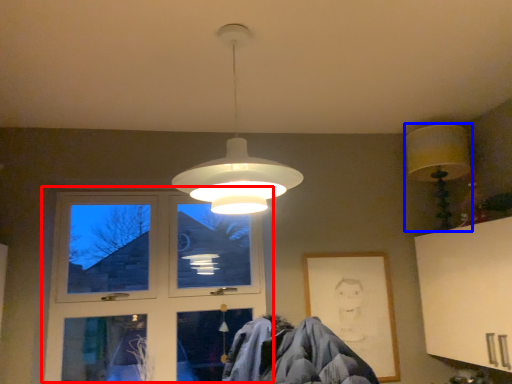
Question: Among these objects, which one is nearest to the camera, window (highlighted by a red box) or lamp (highlighted by a blue box)?

Choices:
 (A) window
 (B) lamp

Answer: (B)